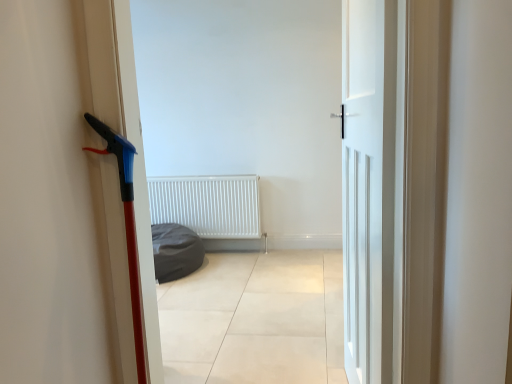
Question: Considering the relative positions of dark gray fabric beanbag at center and white matte door at center in the image provided, is dark gray fabric beanbag at center to the right of white matte door at center from the viewer's perspective?

Choices:
 (A) no
 (B) yes

Answer: (A)

Question: Is dark gray fabric beanbag at center closer to the viewer compared to white matte door at center?

Choices:
 (A) yes
 (B) no

Answer: (B)

Question: From a real-world perspective, is dark gray fabric beanbag at center physically below white matte door at center?

Choices:
 (A) yes
 (B) no

Answer: (A)

Question: Is white matte door at center located within dark gray fabric beanbag at center?

Choices:
 (A) no
 (B) yes

Answer: (A)

Question: Is dark gray fabric beanbag at center not inside white matte door at center?

Choices:
 (A) yes
 (B) no

Answer: (A)

Question: From a real-world perspective, is white matte radiator at center positioned above or below dark gray fabric beanbag at center?

Choices:
 (A) above
 (B) below

Answer: (A)

Question: In the image, is white matte radiator at center on the left side or the right side of dark gray fabric beanbag at center?

Choices:
 (A) left
 (B) right

Answer: (B)

Question: In terms of height, does white matte radiator at center look taller or shorter compared to dark gray fabric beanbag at center?

Choices:
 (A) tall
 (B) short

Answer: (A)

Question: Considering the positions of white matte radiator at center and dark gray fabric beanbag at center in the image, is white matte radiator at center wider or thinner than dark gray fabric beanbag at center?

Choices:
 (A) wide
 (B) thin

Answer: (B)

Question: Is dark gray fabric beanbag at center taller or shorter than white matte door at center?

Choices:
 (A) short
 (B) tall

Answer: (A)

Question: Is dark gray fabric beanbag at center to the left or to the right of white matte door at center in the image?

Choices:
 (A) right
 (B) left

Answer: (B)

Question: Based on their sizes in the image, would you say dark gray fabric beanbag at center is bigger or smaller than white matte door at center?

Choices:
 (A) big
 (B) small

Answer: (B)

Question: From the image's perspective, is dark gray fabric beanbag at center above or below white matte door at center?

Choices:
 (A) above
 (B) below

Answer: (B)

Question: Would you say dark gray fabric beanbag at center is to the left or to the right of white matte radiator at center in the picture?

Choices:
 (A) left
 (B) right

Answer: (A)

Question: Does point (170, 236) appear closer or farther from the camera than point (224, 195)?

Choices:
 (A) closer
 (B) farther

Answer: (A)